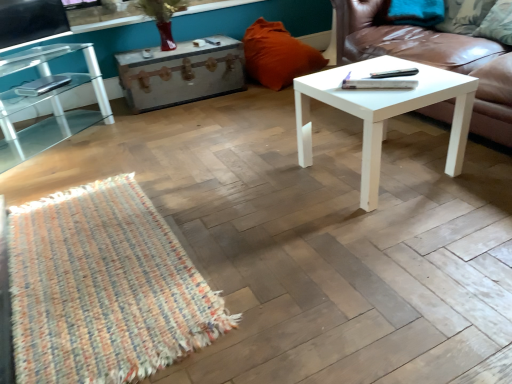
Locate an element on the screen. The height and width of the screenshot is (384, 512). free space to the left of white leather couch at right is located at coordinates (247, 148).